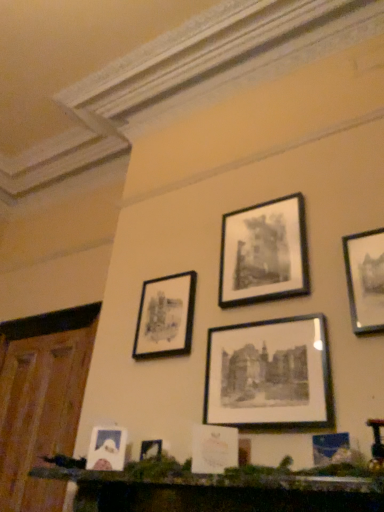
Question: Can you confirm if matte white picture frame at lower left, which is counted as the first picture frame, starting from the left, is shorter than black matte picture frame at center, which appears as the fourth picture frame when viewed from the left?

Choices:
 (A) no
 (B) yes

Answer: (B)

Question: Does matte white picture frame at lower left, which ranks as the 6th picture frame in right-to-left order, come behind black matte picture frame at center, which appears as the fourth picture frame when viewed from the left?

Choices:
 (A) no
 (B) yes

Answer: (B)

Question: Is black matte picture frame at center, which appears as the fourth picture frame when viewed from the left, completely or partially inside matte white picture frame at lower left, which ranks as the 6th picture frame in right-to-left order?

Choices:
 (A) yes
 (B) no

Answer: (B)

Question: Considering the relative sizes of matte white picture frame at lower left, which ranks as the 6th picture frame in right-to-left order, and black matte picture frame at center, the 3th picture frame from the right, in the image provided, is matte white picture frame at lower left, which ranks as the 6th picture frame in right-to-left order, thinner than black matte picture frame at center, the 3th picture frame from the right,?

Choices:
 (A) yes
 (B) no

Answer: (B)

Question: Is matte white picture frame at lower left, which is counted as the first picture frame, starting from the left, wider than black matte picture frame at center, the 3th picture frame from the right?

Choices:
 (A) no
 (B) yes

Answer: (B)

Question: Is black matte picture frame at center, which appears as the fourth picture frame when viewed from the left, wider or thinner than matte black picture frame at upper right, arranged as the 1th picture frame when viewed from the right?

Choices:
 (A) wide
 (B) thin

Answer: (B)

Question: Is black matte picture frame at center, the 3th picture frame from the right, bigger or smaller than matte black picture frame at upper right, arranged as the 1th picture frame when viewed from the right?

Choices:
 (A) small
 (B) big

Answer: (B)

Question: In the image, is black matte picture frame at center, the 3th picture frame from the right, positioned in front of or behind matte black picture frame at upper right, placed as the sixth picture frame when sorted from left to right?

Choices:
 (A) behind
 (B) front

Answer: (A)

Question: Considering the positions of black matte picture frame at center, which appears as the fourth picture frame when viewed from the left, and matte black picture frame at upper right, placed as the sixth picture frame when sorted from left to right, in the image, is black matte picture frame at center, which appears as the fourth picture frame when viewed from the left, taller or shorter than matte black picture frame at upper right, placed as the sixth picture frame when sorted from left to right,?

Choices:
 (A) short
 (B) tall

Answer: (A)

Question: In the image, is wooden mantelpiece at lower center positioned in front of or behind wooden at left?

Choices:
 (A) behind
 (B) front

Answer: (B)

Question: Considering the positions of wooden mantelpiece at lower center and wooden at left in the image, is wooden mantelpiece at lower center wider or thinner than wooden at left?

Choices:
 (A) wide
 (B) thin

Answer: (A)

Question: Is wooden mantelpiece at lower center to the left or to the right of wooden at left in the image?

Choices:
 (A) left
 (B) right

Answer: (B)

Question: From a real-world perspective, is wooden mantelpiece at lower center positioned above or below wooden at left?

Choices:
 (A) above
 (B) below

Answer: (B)

Question: From the image's perspective, is black matte picture frame at upper center, which is the 2th picture frame in right-to-left order, above or below wooden at left?

Choices:
 (A) above
 (B) below

Answer: (A)

Question: Is black matte picture frame at upper center, placed as the 5th picture frame when sorted from left to right, wider or thinner than wooden at left?

Choices:
 (A) wide
 (B) thin

Answer: (B)